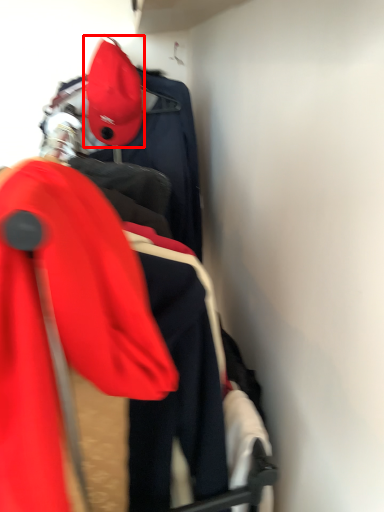
Question: From the image's perspective, what is the correct spatial positioning of hat (annotated by the red box) in reference to ski jacket?

Choices:
 (A) below
 (B) above

Answer: (B)